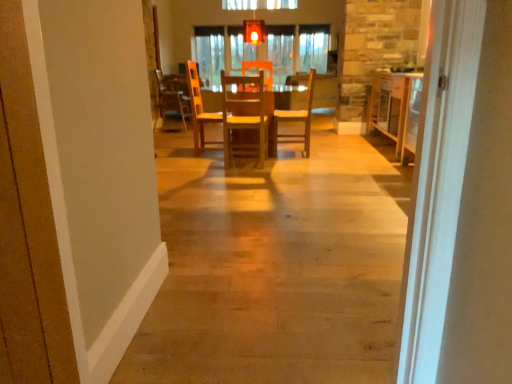
Question: Considering the relative sizes of wooden chair at center, marked as the first chair in a right-to-left arrangement, and wooden table at center, the second table when ordered from right to left, in the image provided, is wooden chair at center, marked as the first chair in a right-to-left arrangement, taller than wooden table at center, the second table when ordered from right to left,?

Choices:
 (A) yes
 (B) no

Answer: (A)

Question: From a real-world perspective, is wooden chair at center, which ranks as the 2th chair in back-to-front order, physically below wooden table at center, which is the 1th table in left-to-right order?

Choices:
 (A) no
 (B) yes

Answer: (A)

Question: From a real-world perspective, is wooden chair at center, the second chair positioned from the front, on top of wooden table at center, which is the 1th table in left-to-right order?

Choices:
 (A) no
 (B) yes

Answer: (B)

Question: Is wooden chair at center, the second chair positioned from the front, shorter than wooden table at center, which is the 1th table in left-to-right order?

Choices:
 (A) yes
 (B) no

Answer: (B)

Question: From the image's perspective, does wooden chair at center, the third chair when ordered from left to right, appear higher than wooden table at center, the second table when ordered from right to left?

Choices:
 (A) yes
 (B) no

Answer: (A)

Question: From the image's perspective, is wooden chair at center, marked as the 1th chair in a front-to-back arrangement, above or below matte glass light fixture at upper center?

Choices:
 (A) above
 (B) below

Answer: (B)

Question: Considering the positions of wooden chair at center, which ranks as the third chair in back-to-front order, and matte glass light fixture at upper center in the image, is wooden chair at center, which ranks as the third chair in back-to-front order, wider or thinner than matte glass light fixture at upper center?

Choices:
 (A) thin
 (B) wide

Answer: (B)

Question: From their relative heights in the image, would you say wooden chair at center, marked as the 2th chair in a right-to-left arrangement, is taller or shorter than matte glass light fixture at upper center?

Choices:
 (A) short
 (B) tall

Answer: (B)

Question: Considering the relative positions of wooden chair at center, which ranks as the third chair in back-to-front order, and matte glass light fixture at upper center in the image provided, is wooden chair at center, which ranks as the third chair in back-to-front order, to the left or to the right of matte glass light fixture at upper center?

Choices:
 (A) right
 (B) left

Answer: (B)

Question: Do you think wooden table at center, the second table when ordered from right to left, is within wooden chair at center, marked as the second chair in a left-to-right arrangement, or outside of it?

Choices:
 (A) outside
 (B) inside

Answer: (A)

Question: Considering the relative positions of wooden table at center, the second table when ordered from right to left, and wooden chair at center, which ranks as the third chair in back-to-front order, in the image provided, is wooden table at center, the second table when ordered from right to left, to the left or to the right of wooden chair at center, which ranks as the third chair in back-to-front order,?

Choices:
 (A) right
 (B) left

Answer: (A)

Question: From a real-world perspective, is wooden table at center, which is the 1th table in left-to-right order, above or below wooden chair at center, marked as the 1th chair in a front-to-back arrangement?

Choices:
 (A) below
 (B) above

Answer: (A)

Question: From the image's perspective, is wooden table at center, which is the 1th table in left-to-right order, located above or below wooden chair at center, marked as the second chair in a left-to-right arrangement?

Choices:
 (A) above
 (B) below

Answer: (A)

Question: Would you say wooden table at center, marked as the 1th table in a right-to-left arrangement, is inside or outside matte glass light fixture at upper center?

Choices:
 (A) outside
 (B) inside

Answer: (A)

Question: In terms of width, does wooden table at center, which is the 2th table from left to right, look wider or thinner when compared to matte glass light fixture at upper center?

Choices:
 (A) thin
 (B) wide

Answer: (B)